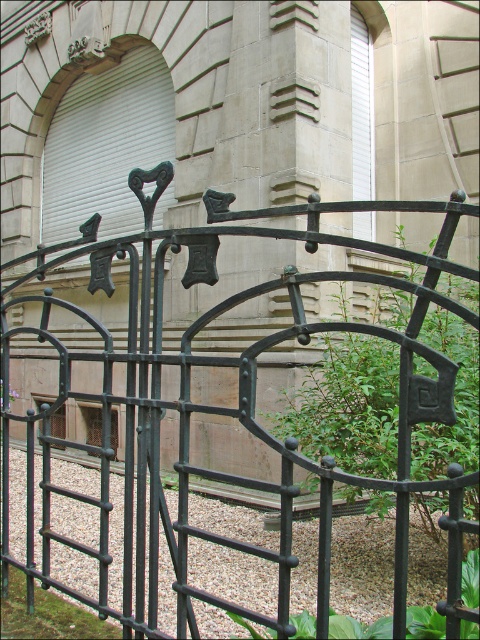
Question: Where is black wrought iron gate at center located in relation to smooth gravel at center in the image?

Choices:
 (A) below
 (B) above

Answer: (B)

Question: Which of the following is the farthest from the observer?

Choices:
 (A) smooth gravel at center
 (B) black wrought iron gate at center

Answer: (A)

Question: Can you confirm if black wrought iron gate at center is positioned below smooth gravel at center?

Choices:
 (A) no
 (B) yes

Answer: (A)

Question: Which object appears closest to the camera in this image?

Choices:
 (A) smooth gravel at center
 (B) black wrought iron gate at center

Answer: (B)

Question: Can you confirm if black wrought iron gate at center is bigger than smooth gravel at center?

Choices:
 (A) yes
 (B) no

Answer: (A)

Question: Which point appears closest to the camera in this image?

Choices:
 (A) (364, 323)
 (B) (80, 516)

Answer: (A)